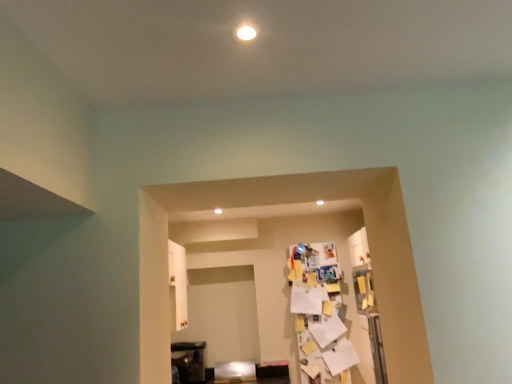
Question: Could you tell me if metallic dark brown cabinet at lower left, the 1th furniture from the left, is turned towards metallic silver fridge at lower center, placed as the second furniture when sorted from left to right?

Choices:
 (A) yes
 (B) no

Answer: (B)

Question: Is metallic dark brown cabinet at lower left, the 1th furniture from the left, looking in the opposite direction of metallic silver fridge at lower center, placed as the second furniture when sorted from left to right?

Choices:
 (A) yes
 (B) no

Answer: (B)

Question: Is metallic dark brown cabinet at lower left, the 1th furniture from the left, thinner than metallic silver fridge at lower center, the 1th furniture from the right?

Choices:
 (A) yes
 (B) no

Answer: (B)

Question: Is the surface of metallic dark brown cabinet at lower left, marked as the 2th furniture in a right-to-left arrangement, in direct contact with metallic silver fridge at lower center, placed as the second furniture when sorted from left to right?

Choices:
 (A) yes
 (B) no

Answer: (B)

Question: Does metallic dark brown cabinet at lower left, the 1th furniture from the left, have a larger size compared to metallic silver fridge at lower center, placed as the second furniture when sorted from left to right?

Choices:
 (A) no
 (B) yes

Answer: (B)

Question: From the image's perspective, is metallic dark brown cabinet at lower left, marked as the 2th furniture in a right-to-left arrangement, located beneath metallic silver fridge at lower center, placed as the second furniture when sorted from left to right?

Choices:
 (A) yes
 (B) no

Answer: (B)

Question: Does metallic silver fridge at lower center, placed as the second furniture when sorted from left to right, come in front of metallic dark brown cabinet at lower left, marked as the 2th furniture in a right-to-left arrangement?

Choices:
 (A) yes
 (B) no

Answer: (A)

Question: From the image's perspective, is metallic silver fridge at lower center, placed as the second furniture when sorted from left to right, below metallic dark brown cabinet at lower left, marked as the 2th furniture in a right-to-left arrangement?

Choices:
 (A) yes
 (B) no

Answer: (A)

Question: Is metallic silver fridge at lower center, placed as the second furniture when sorted from left to right, wider than metallic dark brown cabinet at lower left, the 1th furniture from the left?

Choices:
 (A) no
 (B) yes

Answer: (A)

Question: Is metallic silver fridge at lower center, placed as the second furniture when sorted from left to right, thinner than metallic dark brown cabinet at lower left, marked as the 2th furniture in a right-to-left arrangement?

Choices:
 (A) yes
 (B) no

Answer: (A)

Question: Can you confirm if metallic silver fridge at lower center, placed as the second furniture when sorted from left to right, is taller than metallic dark brown cabinet at lower left, the 1th furniture from the left?

Choices:
 (A) no
 (B) yes

Answer: (A)

Question: Is metallic silver fridge at lower center, placed as the second furniture when sorted from left to right, facing away from metallic dark brown cabinet at lower left, the 1th furniture from the left?

Choices:
 (A) yes
 (B) no

Answer: (B)

Question: Would you say metallic dark brown cabinet at lower left, the 1th furniture from the left, is to the left or to the right of metallic silver fridge at lower center, placed as the second furniture when sorted from left to right, in the picture?

Choices:
 (A) right
 (B) left

Answer: (B)